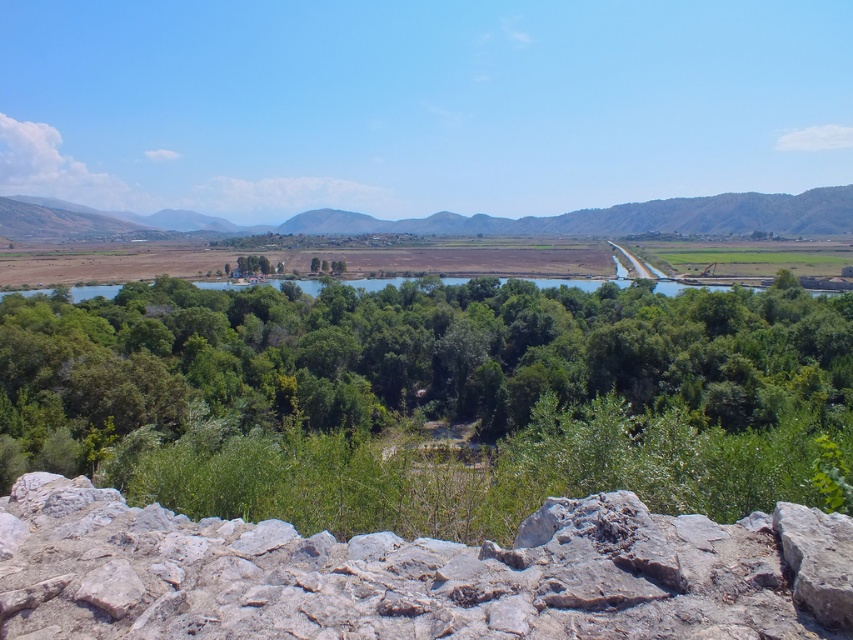
You are a hiker planning to cross the river using a bridge that is 1.2 meters wide. You notice the gray rough stone at bottom and the brown rocky mountain at center in the distance. Which object is closer to the bridge, and can your bridge fit between them?

The gray rough stone at bottom is closer to the bridge than the brown rocky mountain at center. Since the bridge is 1.2 meters wide and the gray rough stone at bottom is shorter than the brown rocky mountain at center, the bridge can fit between them as long as there is enough space horizontally. However, the exact placement would depend on their horizontal distance apart, which isn

You are standing at the rocky outcrop in the foreground of the landscape scene. You notice two points marked in the image. Which point, point 1 at coordinates (585,324) or point 2 at coordinates (186,621), is closer to your current position?

Point 1 at coordinates (585,324) is closer to your current position because it is further to the viewer than point 2 at coordinates (186,621).

You are a hiker standing at the edge of the river. You see the green leafy trees at center and the brown rocky mountain at center. Which object is closer to the ground?

The green leafy trees at center are closer to the ground than the brown rocky mountain at center because the trees are positioned below the mountain.